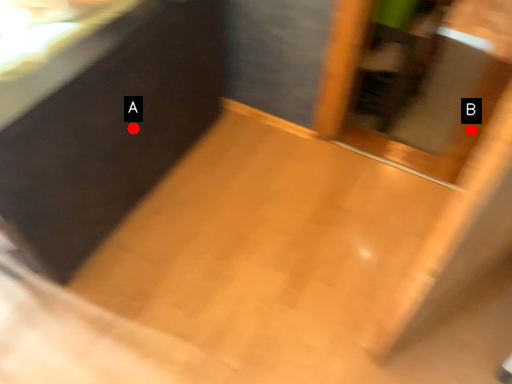
Question: Two points are circled on the image, labeled by A and B beside each circle. Which point is closer to the camera?

Choices:
 (A) A is closer
 (B) B is closer

Answer: (A)